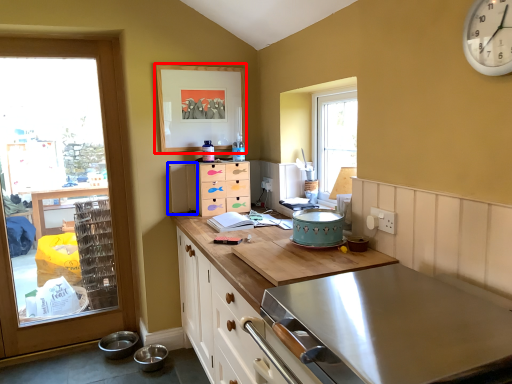
Question: Among these objects, which one is nearest to the camera, picture frame (highlighted by a red box) or appliance (highlighted by a blue box)?

Choices:
 (A) picture frame
 (B) appliance

Answer: (A)